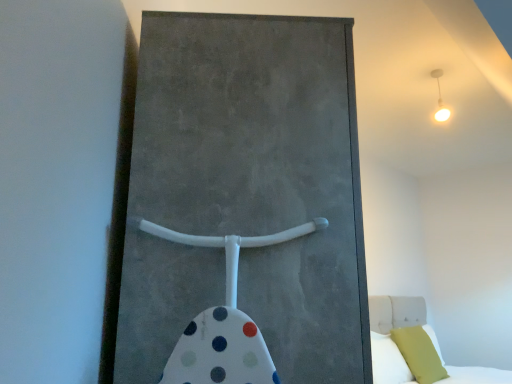
Question: Is concrete textured barn door at center closer to the viewer compared to matte yellow pillow at lower right, which is the 1th pillow from right to left?

Choices:
 (A) no
 (B) yes

Answer: (B)

Question: From a real-world perspective, is concrete textured barn door at center located beneath matte yellow pillow at lower right, which ranks as the second pillow in left-to-right order?

Choices:
 (A) no
 (B) yes

Answer: (A)

Question: Would you say concrete textured barn door at center is a long distance from matte yellow pillow at lower right, which ranks as the second pillow in left-to-right order?

Choices:
 (A) no
 (B) yes

Answer: (B)

Question: Could you tell me if concrete textured barn door at center is facing matte yellow pillow at lower right, which is the 1th pillow from right to left?

Choices:
 (A) no
 (B) yes

Answer: (A)

Question: Is concrete textured barn door at center looking in the opposite direction of matte yellow pillow at lower right, which is the 1th pillow from right to left?

Choices:
 (A) yes
 (B) no

Answer: (B)

Question: Would you say matte yellow pillow at lower right, which ranks as the second pillow in left-to-right order, is to the left or to the right of white fabric bed at lower right in the picture?

Choices:
 (A) right
 (B) left

Answer: (B)

Question: Is matte yellow pillow at lower right, which is the 1th pillow from right to left, inside the boundaries of white fabric bed at lower right, or outside?

Choices:
 (A) inside
 (B) outside

Answer: (A)

Question: From the image's perspective, is matte yellow pillow at lower right, which is the 1th pillow from right to left, located above or below white fabric bed at lower right?

Choices:
 (A) above
 (B) below

Answer: (B)

Question: Is matte yellow pillow at lower right, which ranks as the second pillow in left-to-right order, taller or shorter than white fabric bed at lower right?

Choices:
 (A) short
 (B) tall

Answer: (A)

Question: Would you say white fabric bed at lower right is to the left or to the right of green fabric pillow at lower right, which is the 1th pillow in left-to-right order, in the picture?

Choices:
 (A) left
 (B) right

Answer: (B)

Question: Do you think white fabric bed at lower right is within green fabric pillow at lower right, which is the 2th pillow in right-to-left order, or outside of it?

Choices:
 (A) inside
 (B) outside

Answer: (B)

Question: Considering the positions of white fabric bed at lower right and green fabric pillow at lower right, which is the 2th pillow in right-to-left order, in the image, is white fabric bed at lower right wider or thinner than green fabric pillow at lower right, which is the 2th pillow in right-to-left order,?

Choices:
 (A) thin
 (B) wide

Answer: (B)

Question: Based on their sizes in the image, would you say white fabric bed at lower right is bigger or smaller than green fabric pillow at lower right, which is the 2th pillow in right-to-left order?

Choices:
 (A) small
 (B) big

Answer: (B)

Question: From the image's perspective, is green fabric pillow at lower right, which is the 1th pillow in left-to-right order, located above or below white fabric bed at lower right?

Choices:
 (A) above
 (B) below

Answer: (A)

Question: Considering their positions, is green fabric pillow at lower right, which is the 1th pillow in left-to-right order, located in front of or behind white fabric bed at lower right?

Choices:
 (A) front
 (B) behind

Answer: (B)